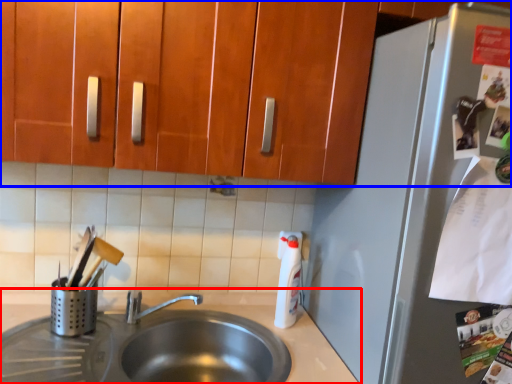
Question: Among these objects, which one is nearest to the camera, countertop (highlighted by a red box) or cabinetry (highlighted by a blue box)?

Choices:
 (A) countertop
 (B) cabinetry

Answer: (B)